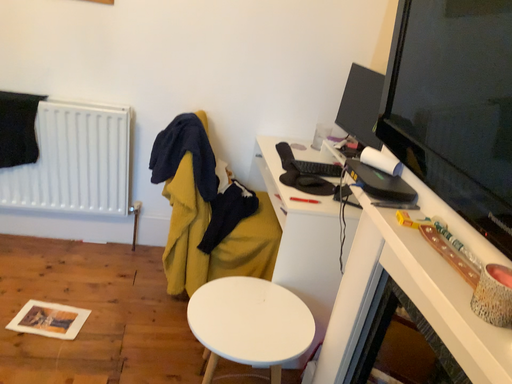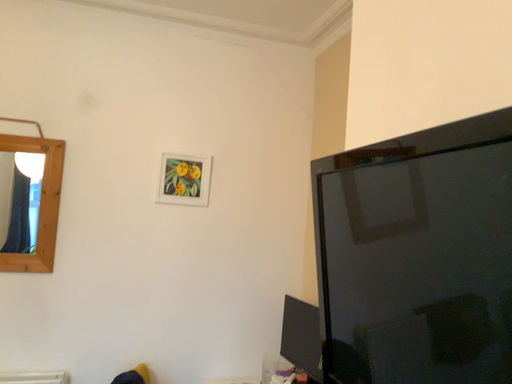
Question: Which way did the camera rotate in the video?

Choices:
 (A) rotated downward
 (B) rotated upward

Answer: (B)